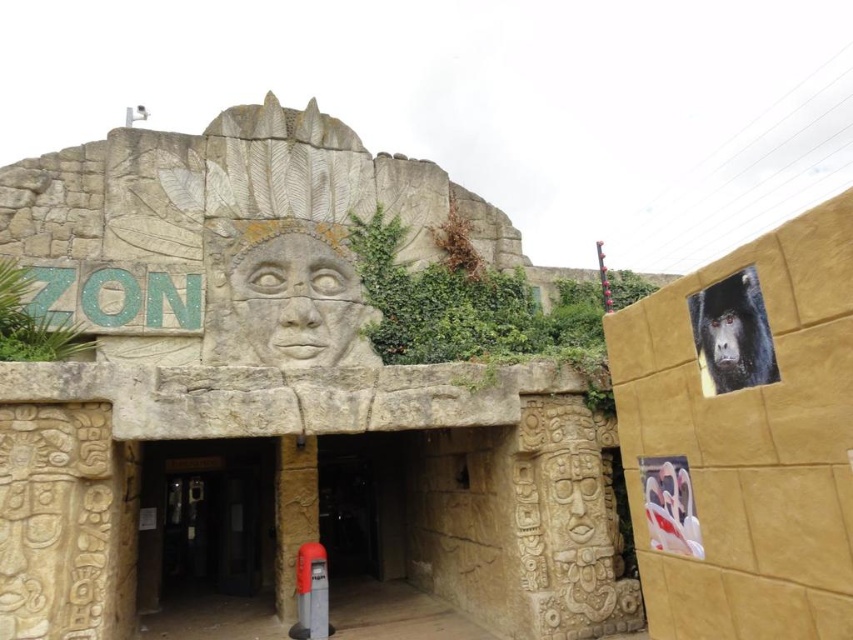
Is rough stone face at center above white glossy statue at lower right?

Indeed, rough stone face at center is positioned over white glossy statue at lower right.

Describe the element at coordinates (297, 301) in the screenshot. Image resolution: width=853 pixels, height=640 pixels. I see `rough stone face at center` at that location.

What are the coordinates of `rough stone face at center` in the screenshot? It's located at (297, 301).

Is rough stone face at center to the right of shiny black monkey at upper right from the viewer's perspective?

Incorrect, rough stone face at center is not on the right side of shiny black monkey at upper right.

Is rough stone face at center above shiny black monkey at upper right?

Yes, rough stone face at center is above shiny black monkey at upper right.

Find the location of `rough stone face at center`. rough stone face at center is located at coordinates (297, 301).

Where is `rough stone face at center`? This screenshot has width=853, height=640. rough stone face at center is located at coordinates (297, 301).

Can you confirm if dark brown stone entrance at center is wider than white glossy statue at lower right?

Indeed, dark brown stone entrance at center has a greater width compared to white glossy statue at lower right.

Between dark brown stone entrance at center and white glossy statue at lower right, which one has less height?

white glossy statue at lower right

Identify the location of dark brown stone entrance at center. This screenshot has width=853, height=640. (206, 518).